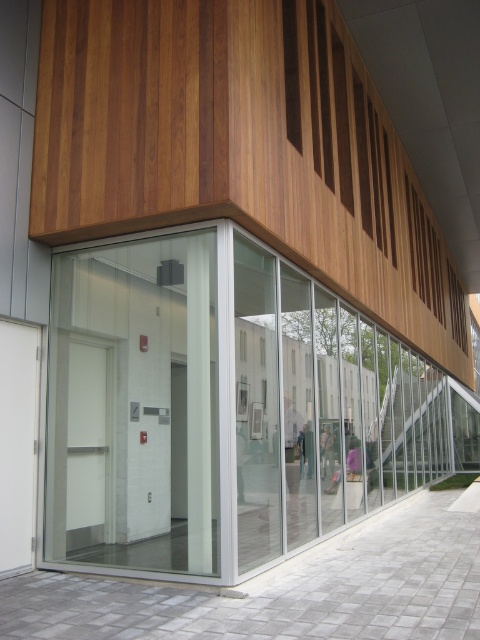
Does transparent glass door at center have a lesser width compared to transparent glass elevator at center?

No, transparent glass door at center is not thinner than transparent glass elevator at center.

Is point (324, 513) closer to camera compared to point (115, 534)?

No, (324, 513) is behind (115, 534).

Is point (360, 344) farther from viewer compared to point (58, 272)?

Yes, it is.

Locate an element on the screen. transparent glass door at center is located at coordinates point(226,406).